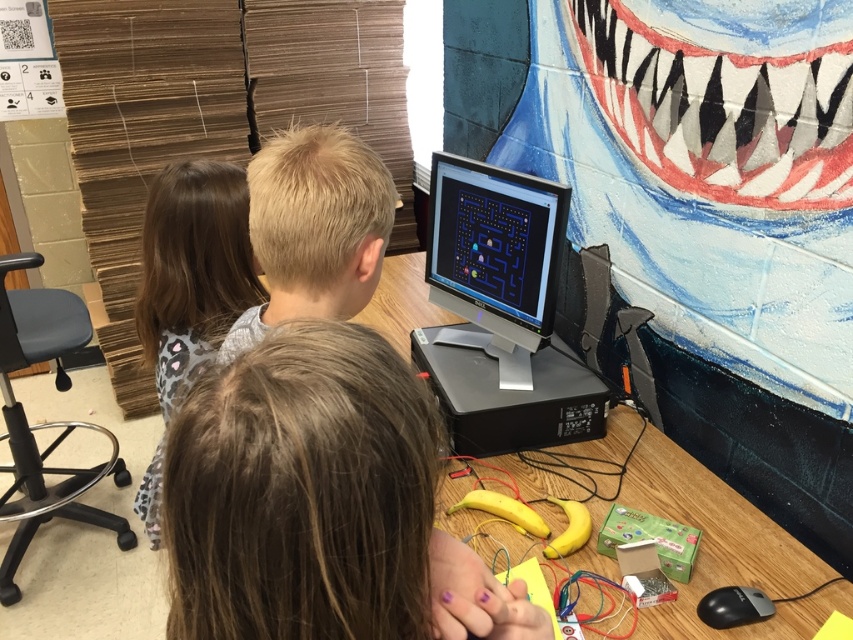
Question: Among these points, which one is farthest from the camera?

Choices:
 (A) (39, 492)
 (B) (180, 394)

Answer: (A)

Question: Is matte black monitor at center positioned at the back of black plastic stool at lower left?

Choices:
 (A) no
 (B) yes

Answer: (A)

Question: Which of the following is the closest to the observer?

Choices:
 (A) brown hair at center
 (B) wooden table at center

Answer: (A)

Question: Which point is farther to the camera?

Choices:
 (A) (798, 563)
 (B) (294, 275)

Answer: (A)

Question: Can you confirm if brown hair at center is positioned to the right of matte black monitor at center?

Choices:
 (A) yes
 (B) no

Answer: (B)

Question: Does matte black monitor at center have a smaller size compared to wooden table at center?

Choices:
 (A) yes
 (B) no

Answer: (A)